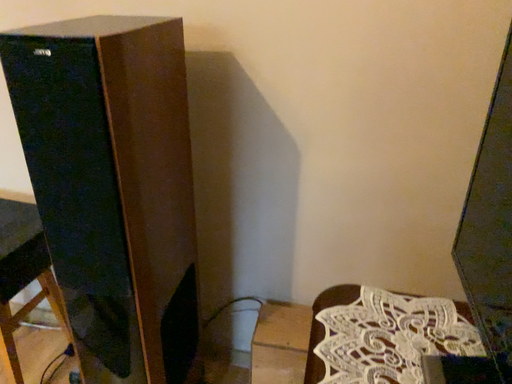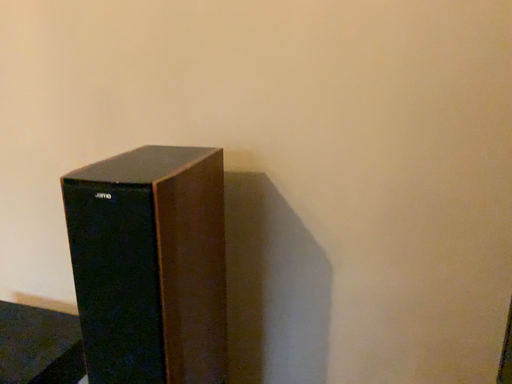
Question: Which way did the camera rotate in the video?

Choices:
 (A) rotated downward
 (B) rotated upward

Answer: (B)